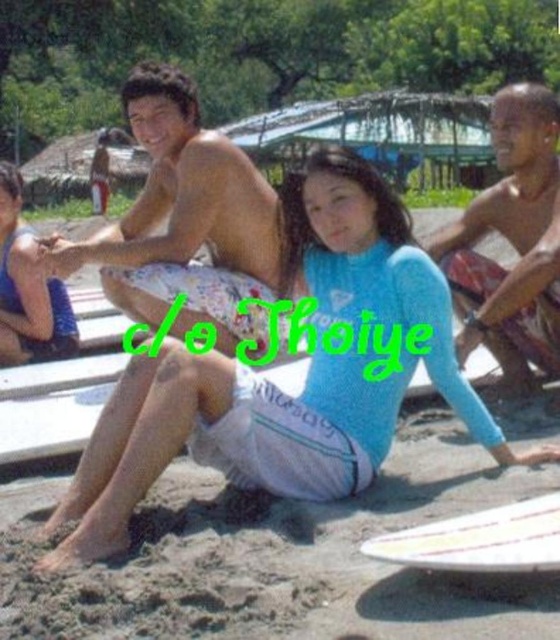
Question: Based on their relative distances, which object is nearer to the blue rubber duck at center?

Choices:
 (A) white glossy surfboard at lower right
 (B) blue wetsuit at lower left
 (C) blue wetsuit at center
 (D) white printed shorts at center

Answer: (D)

Question: Among these points, which one is farthest from the camera?

Choices:
 (A) (42, 349)
 (B) (306, 380)
 (C) (522, 230)
 (D) (432, 550)

Answer: (A)

Question: Is white printed shorts at center wider than blue wetsuit at lower left?

Choices:
 (A) yes
 (B) no

Answer: (A)

Question: Is white printed shorts at center positioned in front of blue wetsuit at lower left?

Choices:
 (A) yes
 (B) no

Answer: (A)

Question: Is blue rubber duck at center positioned behind blue wetsuit at lower left?

Choices:
 (A) yes
 (B) no

Answer: (B)

Question: Among these points, which one is nearest to the camera?

Choices:
 (A) (459, 374)
 (B) (44, 282)
 (C) (416, 556)

Answer: (C)